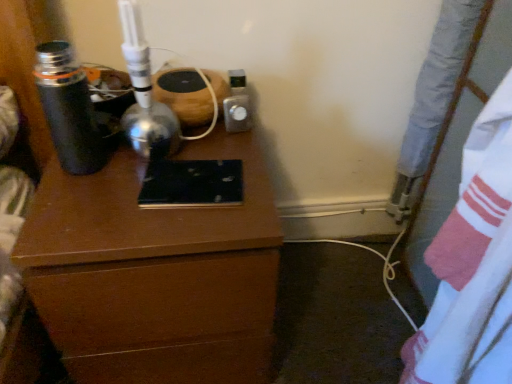
Measure the distance between metallic silver thermos at left and camera.

metallic silver thermos at left is 25.18 inches from camera.

What is the approximate height of brown wood chest of drawers at center?

The height of brown wood chest of drawers at center is 21.62 inches.

Where is `metallic silver thermos at left`? Image resolution: width=512 pixels, height=384 pixels. metallic silver thermos at left is located at coordinates (69, 109).

Is brown wood chest of drawers at center not close to white cotton sheet at right?

Actually, brown wood chest of drawers at center and white cotton sheet at right are a little close together.

Would you say white cotton sheet at right is part of brown wood chest of drawers at center's contents?

No, white cotton sheet at right is not a part of brown wood chest of drawers at center.

Where is `chest of drawers that appears on the left of white cotton sheet at right`? chest of drawers that appears on the left of white cotton sheet at right is located at coordinates (144, 256).

Considering the relative sizes of brown wood chest of drawers at center and white cotton sheet at right in the image provided, is brown wood chest of drawers at center bigger than white cotton sheet at right?

Indeed, brown wood chest of drawers at center has a larger size compared to white cotton sheet at right.

Which object is closer to the camera taking this photo, white cotton sheet at right or metallic silver thermos at left?

white cotton sheet at right is more forward.

Is white cotton sheet at right beside metallic silver thermos at left?

They are not placed beside each other.

Is white cotton sheet at right to the right of metallic silver thermos at left from the viewer's perspective?

Yes, white cotton sheet at right is to the right of metallic silver thermos at left.

Is metallic silver thermos at left looking in the opposite direction of brown wood chest of drawers at center?

That's not correct — metallic silver thermos at left is not looking away from brown wood chest of drawers at center.

In terms of size, does metallic silver thermos at left appear bigger or smaller than brown wood chest of drawers at center?

Clearly, metallic silver thermos at left is smaller in size than brown wood chest of drawers at center.

Is point (44, 105) in front of point (137, 303)?

Yes, point (44, 105) is in front of point (137, 303).

Measure the distance between metallic silver thermos at left and brown wood chest of drawers at center.

metallic silver thermos at left and brown wood chest of drawers at center are 8.97 inches apart.

Is metallic silver thermos at left directly adjacent to white cotton sheet at right?

No, metallic silver thermos at left is not making contact with white cotton sheet at right.

Does point (89, 159) lie in front of point (486, 294)?

No.

How much distance is there between metallic silver thermos at left and white cotton sheet at right?

66.88 centimeters.

The width and height of the screenshot is (512, 384). Find the location of `bottle behind the white cotton sheet at right`. bottle behind the white cotton sheet at right is located at coordinates (69, 109).

In the scene shown: From the image's perspective, between white cotton sheet at right and brown wood chest of drawers at center, who is located below?

white cotton sheet at right, from the image's perspective.

Based on their positions, is white cotton sheet at right located to the left or right of brown wood chest of drawers at center?

From the image, it's evident that white cotton sheet at right is to the right of brown wood chest of drawers at center.

Considering the positions of objects white cotton sheet at right and brown wood chest of drawers at center in the image provided, who is behind, white cotton sheet at right or brown wood chest of drawers at center?

brown wood chest of drawers at center is more distant.

Is there a large distance between white cotton sheet at right and brown wood chest of drawers at center?

white cotton sheet at right is near brown wood chest of drawers at center, not far away.

From the image's perspective, is brown wood chest of drawers at center above or below metallic silver thermos at left?

From the image's perspective, brown wood chest of drawers at center appears below metallic silver thermos at left.

Which object is positioned more to the right, brown wood chest of drawers at center or metallic silver thermos at left?

brown wood chest of drawers at center.

Does brown wood chest of drawers at center have a lesser height compared to metallic silver thermos at left?

In fact, brown wood chest of drawers at center may be taller than metallic silver thermos at left.

Can you tell me how much brown wood chest of drawers at center and metallic silver thermos at left differ in facing direction?

The angular difference between brown wood chest of drawers at center and metallic silver thermos at left is 1.4 degrees.

The height and width of the screenshot is (384, 512). Find the location of `sheet that appears in front of the brown wood chest of drawers at center`. sheet that appears in front of the brown wood chest of drawers at center is located at coordinates (472, 265).

The image size is (512, 384). Find the location of `sheet lying on the right of metallic silver thermos at left`. sheet lying on the right of metallic silver thermos at left is located at coordinates (472, 265).

Looking at the image, which one is located closer to white cotton sheet at right, metallic silver thermos at left or brown wood chest of drawers at center?

brown wood chest of drawers at center is closer to white cotton sheet at right.

When comparing their distances from metallic silver thermos at left, does white cotton sheet at right or brown wood chest of drawers at center seem closer?

The object closer to metallic silver thermos at left is brown wood chest of drawers at center.

From the image, which object appears to be farther from metallic silver thermos at left, brown wood chest of drawers at center or white cotton sheet at right?

Among the two, white cotton sheet at right is located further to metallic silver thermos at left.

Estimate the real-world distances between objects in this image. Which object is closer to white cotton sheet at right, brown wood chest of drawers at center or metallic silver thermos at left?

brown wood chest of drawers at center is closer to white cotton sheet at right.

Estimate the real-world distances between objects in this image. Which object is closer to brown wood chest of drawers at center, metallic silver thermos at left or white cotton sheet at right?

metallic silver thermos at left.

Looking at the image, which one is located further to brown wood chest of drawers at center, white cotton sheet at right or metallic silver thermos at left?

white cotton sheet at right lies further to brown wood chest of drawers at center than the other object.

Where is `chest of drawers between metallic silver thermos at left and white cotton sheet at right`? The width and height of the screenshot is (512, 384). chest of drawers between metallic silver thermos at left and white cotton sheet at right is located at coordinates (144, 256).